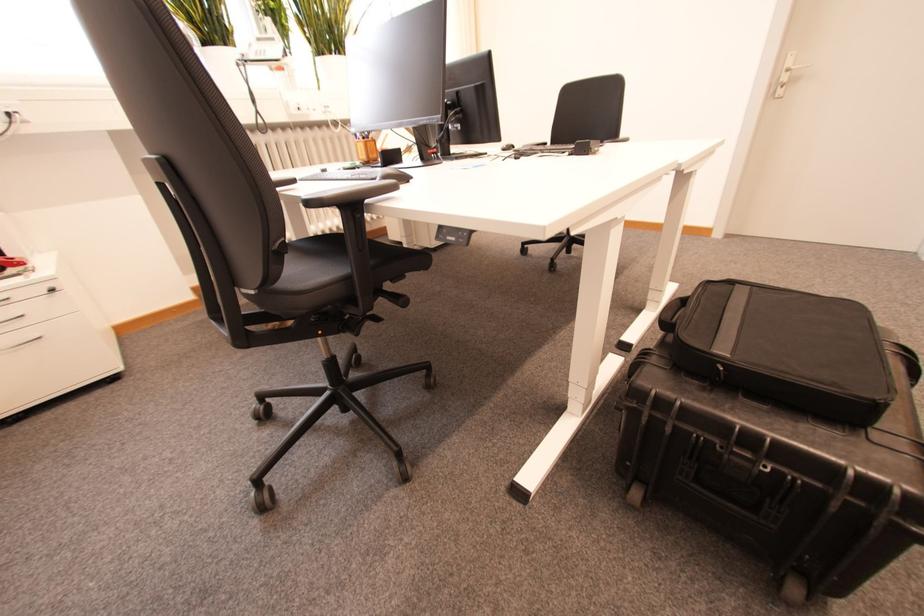
Where would you lift the briefcase handle? Please return your answer as a coordinate pair (x, y).

(672, 313)